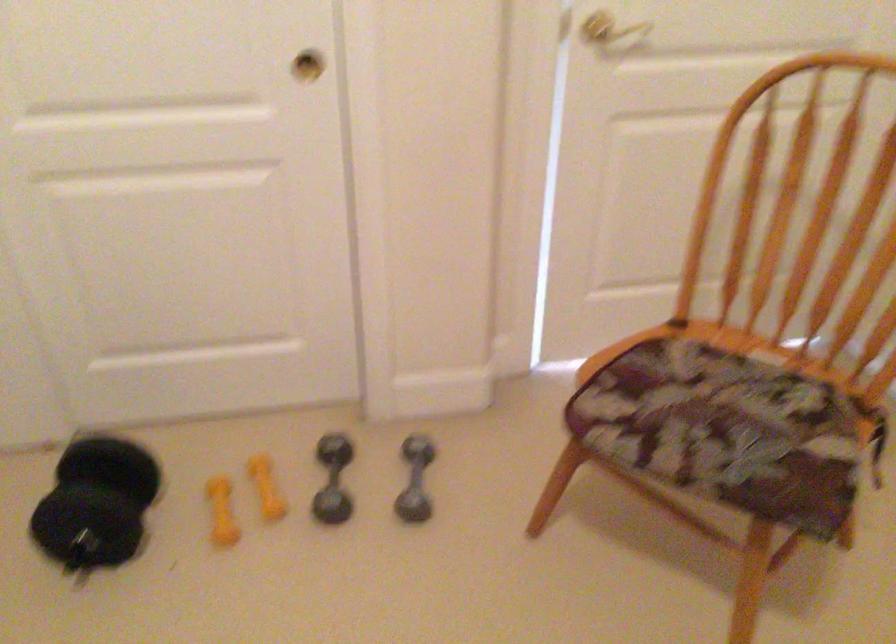
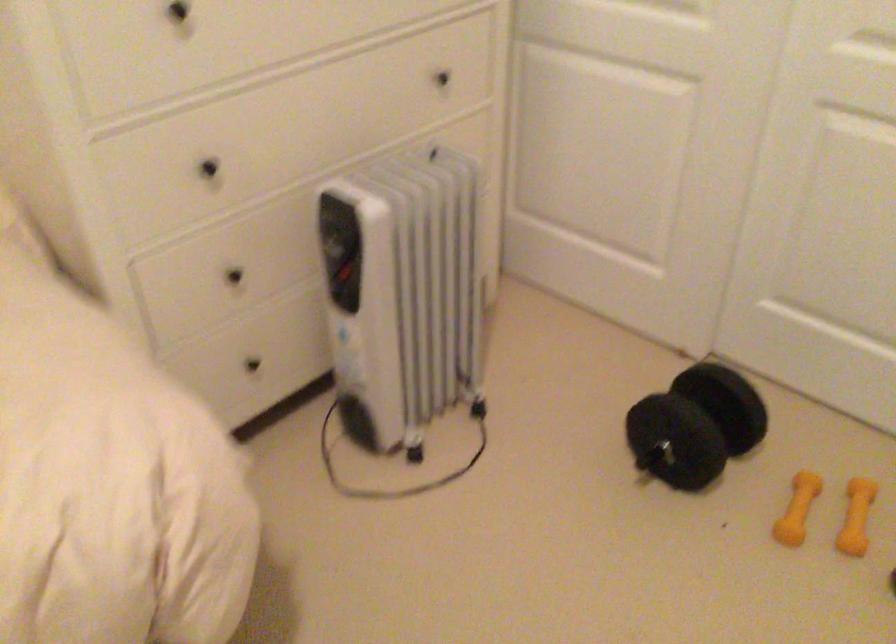
Find the pixel in the second image that matches pixel 236 509 in the first image.

(797, 509)